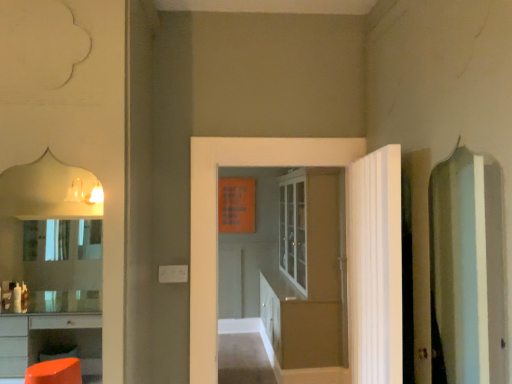
Question: Is there a large distance between white textured door at right, placed as the first door when sorted from front to back, and white glossy door at center, acting as the second door starting from the front?

Choices:
 (A) no
 (B) yes

Answer: (A)

Question: Does white textured door at right, placed as the first door when sorted from front to back, have a lesser height compared to white glossy door at center, acting as the second door starting from the front?

Choices:
 (A) yes
 (B) no

Answer: (A)

Question: Considering the relative positions of white textured door at right, positioned as the third door in back-to-front order, and white glossy door at center, acting as the second door starting from the front, in the image provided, is white textured door at right, positioned as the third door in back-to-front order, to the left of white glossy door at center, acting as the second door starting from the front, from the viewer's perspective?

Choices:
 (A) no
 (B) yes

Answer: (A)

Question: Can you confirm if white textured door at right, positioned as the third door in back-to-front order, is taller than white glossy door at center, which is the 2th door in back-to-front order?

Choices:
 (A) no
 (B) yes

Answer: (A)

Question: Is white textured door at right, placed as the first door when sorted from front to back, aimed at white glossy door at center, acting as the second door starting from the front?

Choices:
 (A) no
 (B) yes

Answer: (B)

Question: Considering the positions of white textured door at right, positioned as the third door in back-to-front order, and matte glass cabinet at center, which is the 3th door from front to back, in the image, is white textured door at right, positioned as the third door in back-to-front order, wider or thinner than matte glass cabinet at center, which is the 3th door from front to back,?

Choices:
 (A) wide
 (B) thin

Answer: (B)

Question: Considering their positions, is white textured door at right, placed as the first door when sorted from front to back, located in front of or behind matte glass cabinet at center, which is the 3th door from front to back?

Choices:
 (A) behind
 (B) front

Answer: (B)

Question: Is white textured door at right, positioned as the third door in back-to-front order, to the left or to the right of matte glass cabinet at center, which is the 3th door from front to back, in the image?

Choices:
 (A) right
 (B) left

Answer: (A)

Question: From their relative heights in the image, would you say white textured door at right, placed as the first door when sorted from front to back, is taller or shorter than matte glass cabinet at center, which is counted as the 1th door, starting from the back?

Choices:
 (A) short
 (B) tall

Answer: (A)

Question: Choose the correct answer: Is white glossy door at center, acting as the second door starting from the front, inside matte glass cabinet at center, which is counted as the 1th door, starting from the back, or outside it?

Choices:
 (A) inside
 (B) outside

Answer: (B)

Question: Is white glossy door at center, which is the 2th door in back-to-front order, taller or shorter than matte glass cabinet at center, which is the 3th door from front to back?

Choices:
 (A) tall
 (B) short

Answer: (B)

Question: Looking at their shapes, would you say white glossy door at center, acting as the second door starting from the front, is wider or thinner than matte glass cabinet at center, which is the 3th door from front to back?

Choices:
 (A) wide
 (B) thin

Answer: (B)

Question: From the image's perspective, relative to matte glass cabinet at center, which is the 3th door from front to back, is white glossy door at center, which is the 2th door in back-to-front order, above or below?

Choices:
 (A) above
 (B) below

Answer: (A)

Question: From the image's perspective, is white textured door at right, placed as the first door when sorted from front to back, located above or below white glossy door at center, which is the 2th door in back-to-front order?

Choices:
 (A) above
 (B) below

Answer: (B)

Question: Does point (362, 165) appear closer or farther from the camera than point (208, 150)?

Choices:
 (A) closer
 (B) farther

Answer: (A)